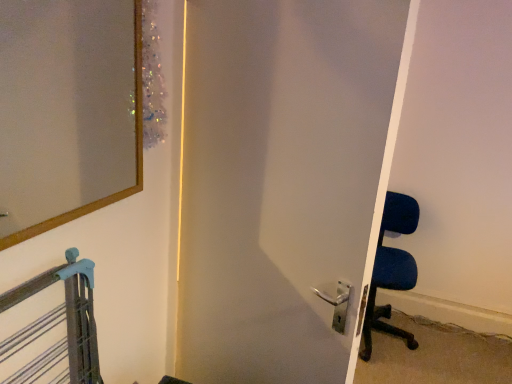
Question: Is satin white door at center next to blue fabric chair at right and touching it?

Choices:
 (A) yes
 (B) no

Answer: (B)

Question: From a real-world perspective, is satin white door at center below blue fabric chair at right?

Choices:
 (A) no
 (B) yes

Answer: (A)

Question: Does satin white door at center have a lesser height compared to blue fabric chair at right?

Choices:
 (A) no
 (B) yes

Answer: (A)

Question: From a real-world perspective, is satin white door at center on top of blue fabric chair at right?

Choices:
 (A) no
 (B) yes

Answer: (B)

Question: Can you confirm if satin white door at center is thinner than blue fabric chair at right?

Choices:
 (A) yes
 (B) no

Answer: (A)

Question: Is satin white door at center aimed at blue fabric chair at right?

Choices:
 (A) no
 (B) yes

Answer: (B)

Question: Can you confirm if wooden-framed mirror at upper left is taller than blue fabric chair at right?

Choices:
 (A) yes
 (B) no

Answer: (B)

Question: From the image's perspective, is wooden-framed mirror at upper left above blue fabric chair at right?

Choices:
 (A) no
 (B) yes

Answer: (B)

Question: Is the position of wooden-framed mirror at upper left less distant than that of blue fabric chair at right?

Choices:
 (A) yes
 (B) no

Answer: (A)

Question: Is wooden-framed mirror at upper left at the right side of blue fabric chair at right?

Choices:
 (A) yes
 (B) no

Answer: (B)

Question: From the image's perspective, would you say wooden-framed mirror at upper left is shown under blue fabric chair at right?

Choices:
 (A) no
 (B) yes

Answer: (A)

Question: Does wooden-framed mirror at upper left lie behind blue fabric chair at right?

Choices:
 (A) yes
 (B) no

Answer: (B)

Question: Is satin white door at center with wooden-framed mirror at upper left?

Choices:
 (A) yes
 (B) no

Answer: (B)